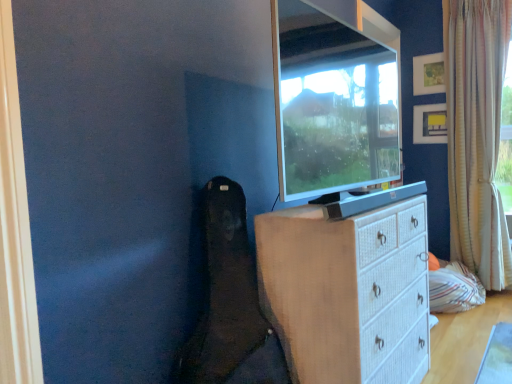
Question: Is white wicker chest of drawers at center completely or partially outside of matte black tv at upper center?

Choices:
 (A) yes
 (B) no

Answer: (A)

Question: Does white wicker chest of drawers at center come in front of matte black tv at upper center?

Choices:
 (A) no
 (B) yes

Answer: (A)

Question: Is matte black tv at upper center completely or partially inside white wicker chest of drawers at center?

Choices:
 (A) no
 (B) yes

Answer: (A)

Question: Considering the relative sizes of white wicker chest of drawers at center and matte black tv at upper center in the image provided, is white wicker chest of drawers at center bigger than matte black tv at upper center?

Choices:
 (A) no
 (B) yes

Answer: (B)

Question: From the image's perspective, is white wicker chest of drawers at center over matte black tv at upper center?

Choices:
 (A) no
 (B) yes

Answer: (A)

Question: Is white wicker chest of drawers at center taller than matte black tv at upper center?

Choices:
 (A) no
 (B) yes

Answer: (B)

Question: Is matte yellow picture frame at upper right, which appears as the 2th picture frame when viewed from the top, smaller than white textured curtain at right?

Choices:
 (A) yes
 (B) no

Answer: (A)

Question: From a real-world perspective, is matte yellow picture frame at upper right, the first picture frame in the bottom-to-top sequence, below white textured curtain at right?

Choices:
 (A) no
 (B) yes

Answer: (A)

Question: Is matte yellow picture frame at upper right, the first picture frame in the bottom-to-top sequence, taller than white textured curtain at right?

Choices:
 (A) no
 (B) yes

Answer: (A)

Question: Is white textured curtain at right at the back of matte yellow picture frame at upper right, the first picture frame in the bottom-to-top sequence?

Choices:
 (A) yes
 (B) no

Answer: (B)

Question: Is matte yellow picture frame at upper right, the first picture frame in the bottom-to-top sequence, thinner than white textured curtain at right?

Choices:
 (A) no
 (B) yes

Answer: (B)

Question: Is matte yellow picture frame at upper right, the first picture frame in the bottom-to-top sequence, to the left of white textured curtain at right from the viewer's perspective?

Choices:
 (A) no
 (B) yes

Answer: (B)

Question: From the image's perspective, is matte black tv at upper center below matte yellow picture frame at upper right, which appears as the 2th picture frame when viewed from the top?

Choices:
 (A) yes
 (B) no

Answer: (A)